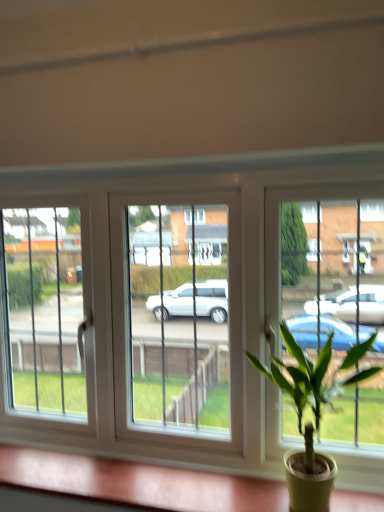
Question: Is green matte plant pot at lower right bigger or smaller than green leafy plant in pot at center?

Choices:
 (A) big
 (B) small

Answer: (B)

Question: Do you think green matte plant pot at lower right is within green leafy plant in pot at center, or outside of it?

Choices:
 (A) inside
 (B) outside

Answer: (B)

Question: Visually, is green matte plant pot at lower right positioned to the left or to the right of green leafy plant in pot at center?

Choices:
 (A) left
 (B) right

Answer: (A)

Question: Which is correct: green leafy plant in pot at center is inside green matte plant pot at lower right, or outside of it?

Choices:
 (A) inside
 (B) outside

Answer: (B)

Question: Considering their positions, is green leafy plant in pot at center located in front of or behind green matte plant pot at lower right?

Choices:
 (A) behind
 (B) front

Answer: (B)

Question: In terms of width, does green leafy plant in pot at center look wider or thinner when compared to green matte plant pot at lower right?

Choices:
 (A) thin
 (B) wide

Answer: (B)

Question: From a real-world perspective, is green leafy plant in pot at center positioned above or below green matte plant pot at lower right?

Choices:
 (A) above
 (B) below

Answer: (A)